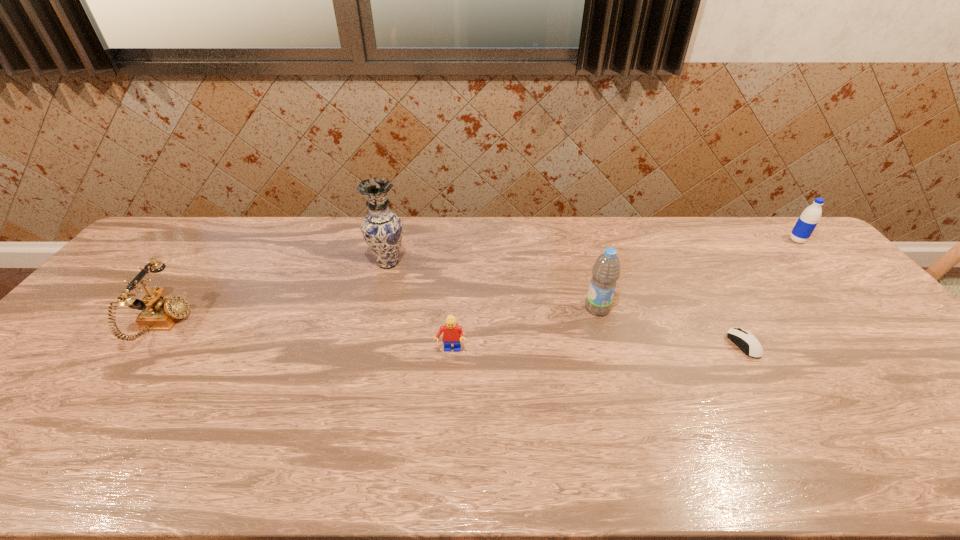
This screenshot has width=960, height=540. What are the coordinates of `mouse` in the screenshot? It's located at click(747, 342).

What are the coordinates of `vacant space located 0.260m on the right of the fifth object from right to left` in the screenshot? It's located at (489, 263).

You are a GUI agent. You are given a task and a screenshot of the screen. Output one action in this format:
    pyautogui.click(x=<x>, y=<y>)
    Task: Click on the free space located 0.390m on the right of the fourth object from left to right
    
    Given the screenshot: What is the action you would take?
    pyautogui.click(x=747, y=308)

I want to click on vacant space located 0.220m on the dial number of the telephone, so click(x=265, y=325).

Identify the location of free location located 0.290m on the left of the farthest object. The height and width of the screenshot is (540, 960). (705, 240).

I want to click on vacant space located 0.190m on the front-facing side of the Lego, so click(445, 423).

This screenshot has height=540, width=960. I want to click on free region located on the right of the mouse, so click(833, 345).

In order to click on vase that is positioned at the far edge in this screenshot , I will do `click(382, 229)`.

Locate an element on the screen. This screenshot has height=540, width=960. water bottle that is positioned at the far edge is located at coordinates 810,217.

This screenshot has width=960, height=540. I want to click on object that is positioned at the right edge, so click(810, 217).